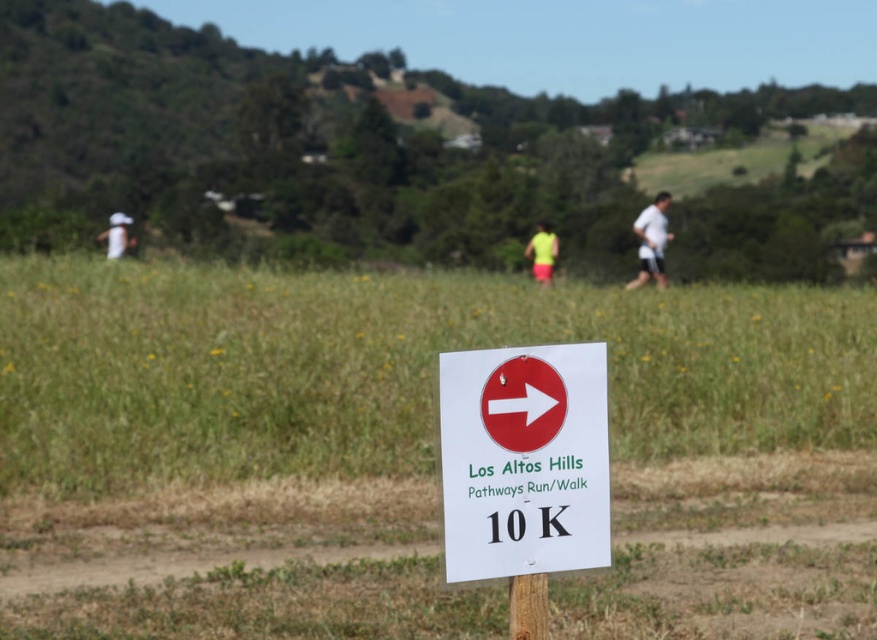
Between green grassy hill at upper center and neon yellow fabric at center, which one is positioned higher?

green grassy hill at upper center is higher up.

Can you confirm if green grassy hill at upper center is thinner than neon yellow fabric at center?

No, green grassy hill at upper center is not thinner than neon yellow fabric at center.

In order to click on green grassy hill at upper center in this screenshot , I will do `click(321, 145)`.

Can you confirm if white paper sign at center is shorter than brown wooden pole at center?

Incorrect, white paper sign at center's height does not fall short of brown wooden pole at center's.

Is point (870, 433) in front of point (542, 600)?

No, it is behind (542, 600).

Who is more distant from viewer, (56, 365) or (510, 592)?

The point (56, 365) is more distant.

At what (x,y) coordinates should I click in order to perform the action: click on white paper sign at center. Please return your answer as a coordinate pair (x, y). The image size is (877, 640). Looking at the image, I should click on (389, 369).

Is point (660, 200) in front of point (547, 269)?

Yes, point (660, 200) is in front of point (547, 269).

Is white matte shirt at upper right smaller than neon yellow fabric at center?

Actually, white matte shirt at upper right might be larger than neon yellow fabric at center.

Locate an element on the screen. white matte shirt at upper right is located at coordinates (651, 243).

I want to click on white matte shirt at upper right, so click(651, 243).